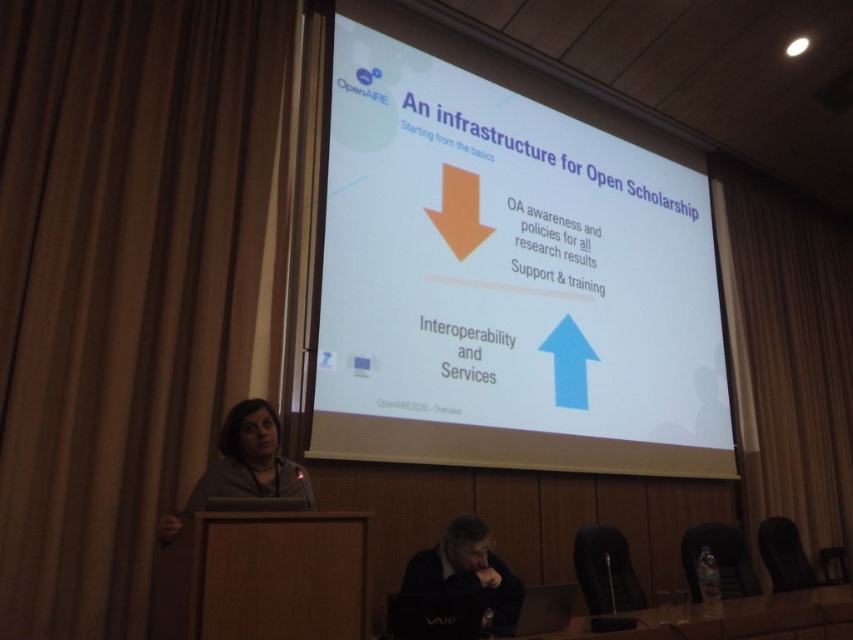
Question: Is clear plastic water bottle at lower right positioned at the back of dark gray sweater at lower center?

Choices:
 (A) yes
 (B) no

Answer: (A)

Question: Which of these objects is positioned farthest from the beige fabric curtain at right?

Choices:
 (A) wooden table at lower center
 (B) brown fabric curtain at left

Answer: (A)

Question: Can you confirm if white matte projector screen at center is positioned to the left of dark gray sweater at lower left?

Choices:
 (A) no
 (B) yes

Answer: (A)

Question: Which of the following is the farthest from the observer?

Choices:
 (A) beige fabric curtain at right
 (B) clear plastic water bottle at lower right

Answer: (A)

Question: Which is farther from the brown fabric curtain at left?

Choices:
 (A) beige fabric curtain at right
 (B) clear plastic water bottle at lower right
 (C) dark gray sweater at lower center

Answer: (A)

Question: Considering the relative positions of beige fabric curtain at right and wooden table at lower center in the image provided, where is beige fabric curtain at right located with respect to wooden table at lower center?

Choices:
 (A) below
 (B) above

Answer: (B)